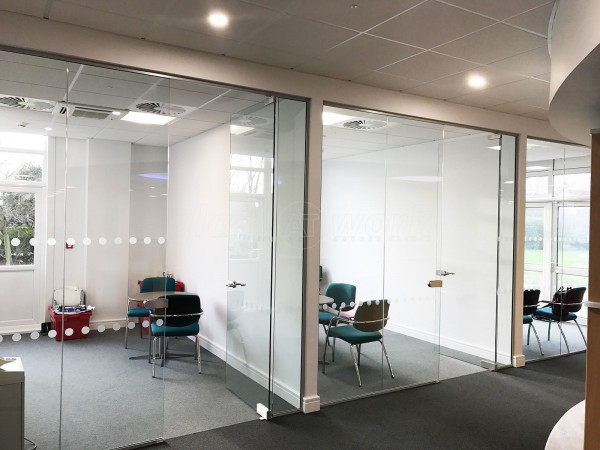
Where is `window`? This screenshot has height=450, width=600. window is located at coordinates (21, 220), (581, 236), (536, 224).